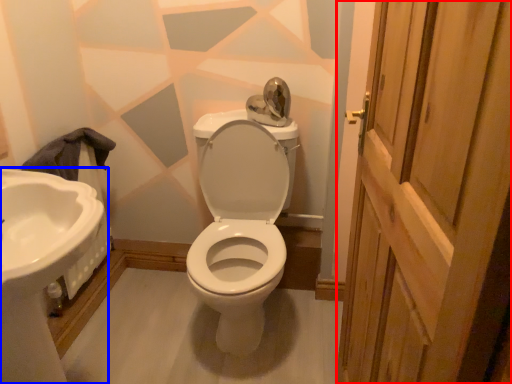
Question: Which object appears closest to the camera in this image, screen door (highlighted by a red box) or sink (highlighted by a blue box)?

Choices:
 (A) screen door
 (B) sink

Answer: (A)